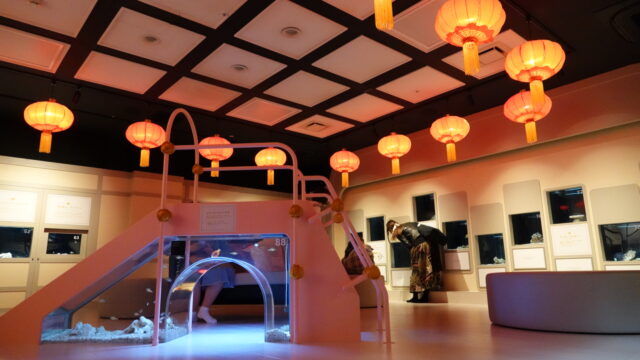
Identify the location of floor. (431, 336).